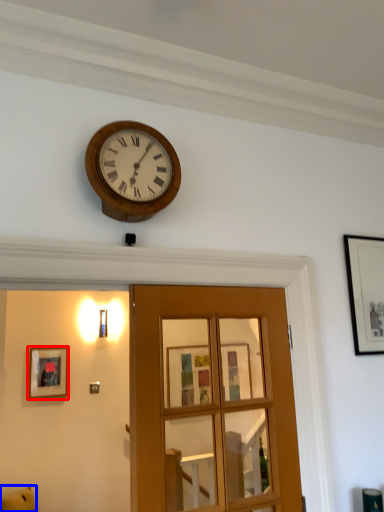
Question: Which point is closer to the camera, picture frame (highlighted by a red box) or furniture (highlighted by a blue box)?

Choices:
 (A) picture frame
 (B) furniture

Answer: (B)